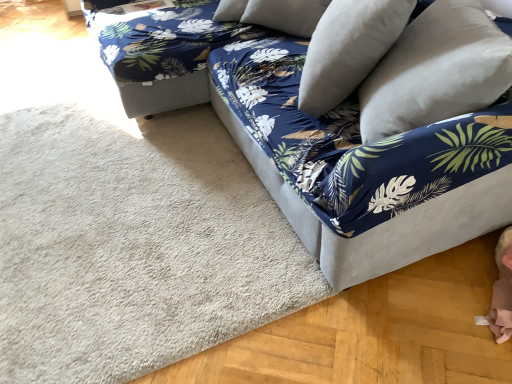
Question: Visually, is beige carpet at lower left positioned to the left or to the right of white soft pillow at upper right, the second pillow positioned from the right?

Choices:
 (A) right
 (B) left

Answer: (B)

Question: In terms of size, does beige carpet at lower left appear bigger or smaller than white soft pillow at upper right, the second pillow positioned from the right?

Choices:
 (A) small
 (B) big

Answer: (A)

Question: Which object is positioned farthest from the velvet blue couch at center?

Choices:
 (A) velvety white pillow at upper right, which ranks as the second pillow in left-to-right order
 (B) blue floral fabric bean bag at upper right
 (C) white soft pillow at upper right, marked as the 1th pillow in a left-to-right arrangement
 (D) beige carpet at lower left

Answer: (D)

Question: Estimate the real-world distances between objects in this image. Which object is closer to the beige carpet at lower left?

Choices:
 (A) white soft pillow at upper right, marked as the 1th pillow in a left-to-right arrangement
 (B) velvet blue couch at center
 (C) velvety white pillow at upper right, the first pillow viewed from the right
 (D) blue floral fabric bean bag at upper right

Answer: (B)